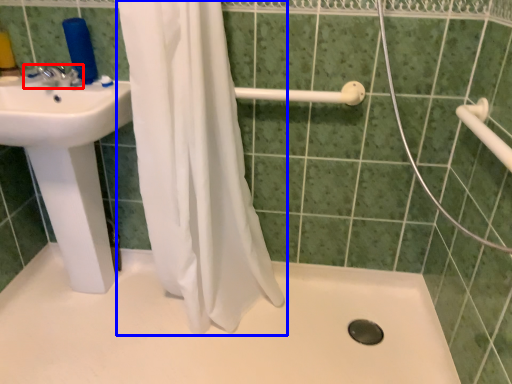
Question: Which of the following is the farthest to the observer, tap (highlighted by a red box) or curtain (highlighted by a blue box)?

Choices:
 (A) tap
 (B) curtain

Answer: (A)